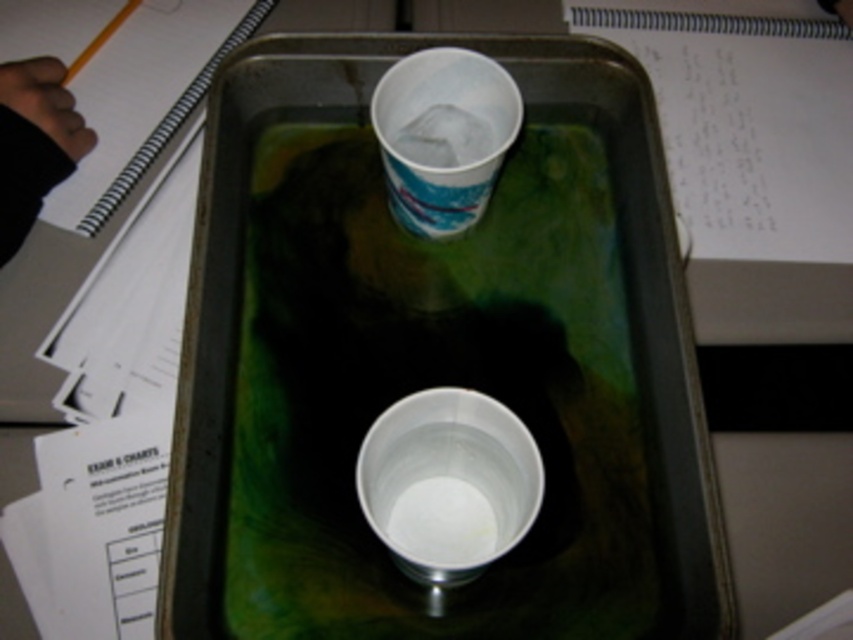
Question: Which of the following is the farthest from the observer?

Choices:
 (A) (202, 90)
 (B) (442, 388)

Answer: (A)

Question: Can you confirm if white plastic cup at center is positioned to the left of white spiral notebook at upper left?

Choices:
 (A) yes
 (B) no

Answer: (B)

Question: Can you confirm if metallic silver tray at center is positioned to the left of white spiral notebook at upper left?

Choices:
 (A) yes
 (B) no

Answer: (B)

Question: Which of the following is the closest to the observer?

Choices:
 (A) (488, 493)
 (B) (480, 77)
 (C) (227, 38)

Answer: (A)

Question: Considering the real-world distances, which object is farthest from the white plastic cup at center?

Choices:
 (A) metallic silver tray at center
 (B) white spiral notebook at upper left
 (C) white paper cup at upper center

Answer: (B)

Question: Is metallic silver tray at center positioned in front of white paper cup at upper center?

Choices:
 (A) yes
 (B) no

Answer: (A)